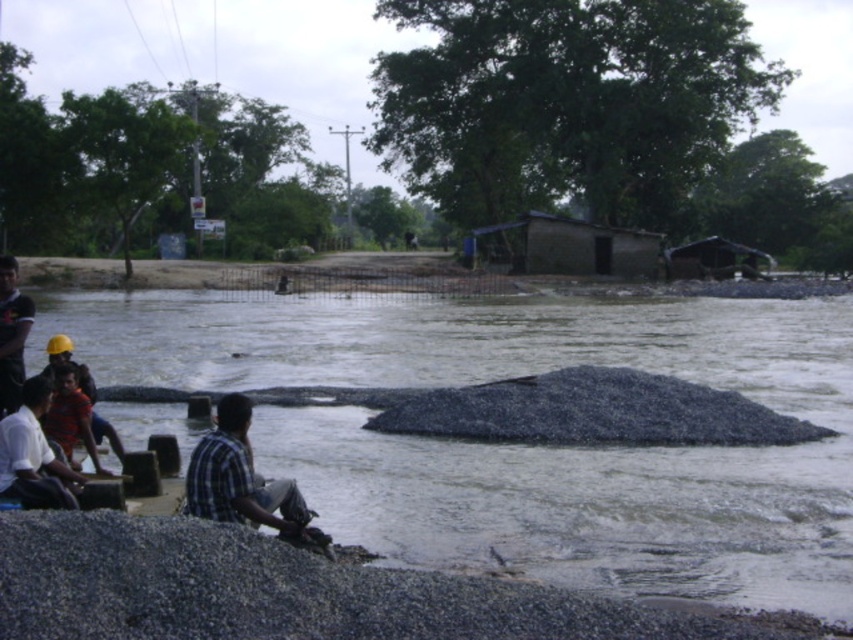
Question: Which point is farther to the camera?

Choices:
 (A) click(x=190, y=579)
 (B) click(x=16, y=378)
 (C) click(x=260, y=372)

Answer: (C)

Question: Is plaid shirt at lower left smaller than dark brown mud hut at center?

Choices:
 (A) no
 (B) yes

Answer: (B)

Question: Is gray gravel river at center below dark blue plaid shirt at left?

Choices:
 (A) no
 (B) yes

Answer: (B)

Question: Which of the following is the farthest from the observer?

Choices:
 (A) dark brown mud hut at center
 (B) brown corrugated metal hut at center right

Answer: (B)

Question: Does gray gravel river at center appear on the left side of white shirt at left?

Choices:
 (A) no
 (B) yes

Answer: (A)

Question: Which point is farther to the camera?

Choices:
 (A) gray gravel river at center
 (B) brown corrugated metal hut at center right
 (C) dark brown mud hut at center
 (D) dark blue plaid shirt at left

Answer: (B)